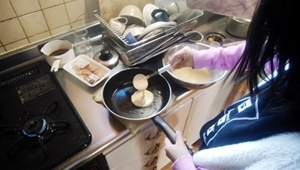
Image resolution: width=300 pixels, height=170 pixels. What are the coordinates of `white part of ladle handle` in the screenshot? It's located at (168, 67).